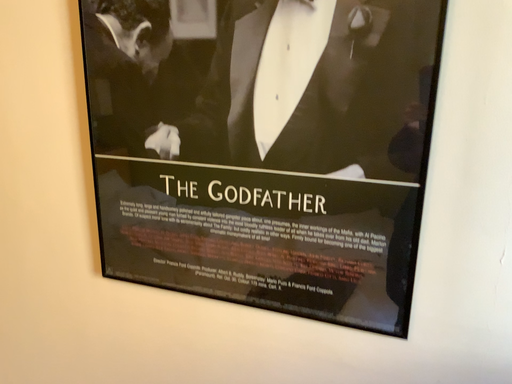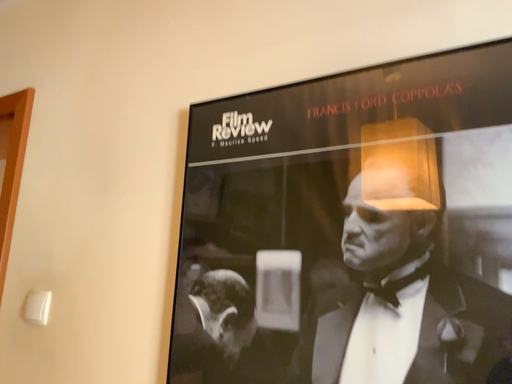
Question: How did the camera likely rotate when shooting the video?

Choices:
 (A) rotated left
 (B) rotated right

Answer: (A)